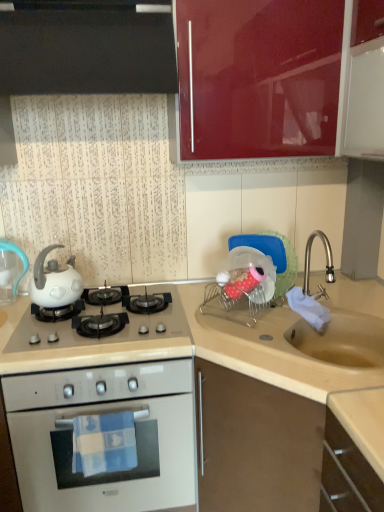
Question: Does black glossy cabinet at upper left, marked as the 3th cabinetry in a bottom-to-top arrangement, appear on the left side of white glossy gas stove at center?

Choices:
 (A) no
 (B) yes

Answer: (B)

Question: From the image's perspective, is black glossy cabinet at upper left, positioned as the first cabinetry in top-to-bottom order, on top of white glossy gas stove at center?

Choices:
 (A) no
 (B) yes

Answer: (B)

Question: Considering the relative sizes of black glossy cabinet at upper left, marked as the 3th cabinetry in a bottom-to-top arrangement, and white glossy gas stove at center in the image provided, is black glossy cabinet at upper left, marked as the 3th cabinetry in a bottom-to-top arrangement, taller than white glossy gas stove at center?

Choices:
 (A) yes
 (B) no

Answer: (A)

Question: From a real-world perspective, is black glossy cabinet at upper left, positioned as the first cabinetry in top-to-bottom order, under white glossy gas stove at center?

Choices:
 (A) yes
 (B) no

Answer: (B)

Question: Does black glossy cabinet at upper left, marked as the 3th cabinetry in a bottom-to-top arrangement, have a smaller size compared to white glossy gas stove at center?

Choices:
 (A) yes
 (B) no

Answer: (B)

Question: From the image's perspective, is white glossy kettle at left located above or below white glossy oven at lower left?

Choices:
 (A) above
 (B) below

Answer: (A)

Question: Choose the correct answer: Is white glossy kettle at left inside white glossy oven at lower left or outside it?

Choices:
 (A) inside
 (B) outside

Answer: (B)

Question: Is white glossy kettle at left taller or shorter than white glossy oven at lower left?

Choices:
 (A) short
 (B) tall

Answer: (A)

Question: In terms of width, does white glossy kettle at left look wider or thinner when compared to white glossy oven at lower left?

Choices:
 (A) thin
 (B) wide

Answer: (A)

Question: Is white glossy kettle at left situated inside white glossy teapot at left or outside?

Choices:
 (A) inside
 (B) outside

Answer: (B)

Question: From a real-world perspective, is white glossy kettle at left above or below white glossy teapot at left?

Choices:
 (A) below
 (B) above

Answer: (A)

Question: From the image's perspective, is white glossy kettle at left above or below white glossy teapot at left?

Choices:
 (A) below
 (B) above

Answer: (B)

Question: Is point (26, 257) positioned closer to the camera than point (54, 307)?

Choices:
 (A) farther
 (B) closer

Answer: (A)

Question: Relative to beige matte sink at lower right, positioned as the first cabinetry in bottom-to-top order, is black glossy cabinet at upper left, positioned as the first cabinetry in top-to-bottom order, in front or behind?

Choices:
 (A) front
 (B) behind

Answer: (B)

Question: In terms of height, does black glossy cabinet at upper left, positioned as the first cabinetry in top-to-bottom order, look taller or shorter compared to beige matte sink at lower right, positioned as the first cabinetry in bottom-to-top order?

Choices:
 (A) short
 (B) tall

Answer: (A)